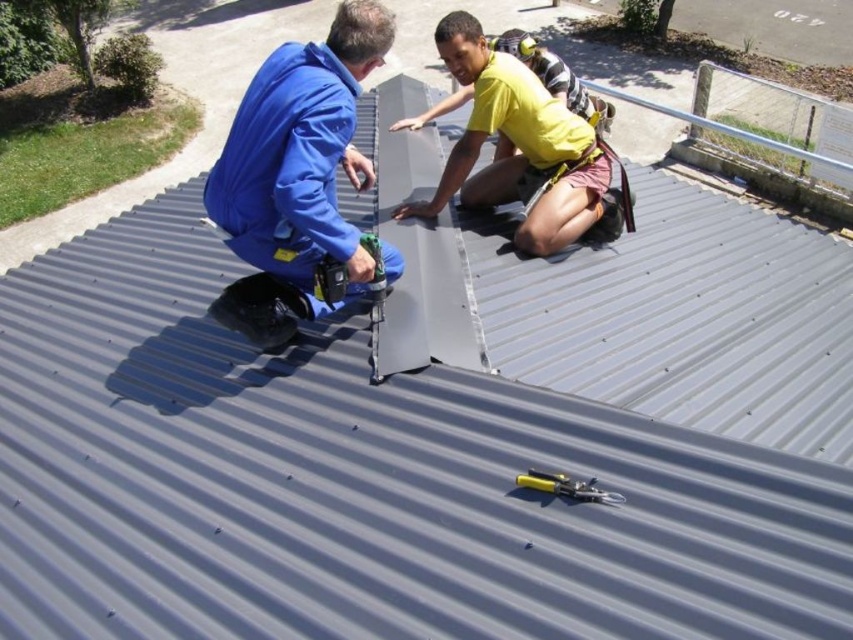
Question: Is matte blue jumpsuit at upper left above yellow matte shirt at upper center?

Choices:
 (A) yes
 (B) no

Answer: (B)

Question: Estimate the real-world distances between objects in this image. Which object is closer to the matte blue jumpsuit at upper left?

Choices:
 (A) yellow matte shirt at upper center
 (B) yellow plastic pliers at center

Answer: (A)

Question: Which is nearer to the yellow plastic pliers at center?

Choices:
 (A) yellow matte shirt at upper center
 (B) matte blue jumpsuit at upper left

Answer: (B)

Question: Can you confirm if yellow matte shirt at upper center is smaller than yellow plastic pliers at center?

Choices:
 (A) yes
 (B) no

Answer: (B)

Question: Can you confirm if yellow matte shirt at upper center is smaller than yellow plastic pliers at center?

Choices:
 (A) yes
 (B) no

Answer: (B)

Question: Which object is positioned farthest from the yellow matte shirt at upper center?

Choices:
 (A) matte blue jumpsuit at upper left
 (B) yellow plastic pliers at center

Answer: (B)